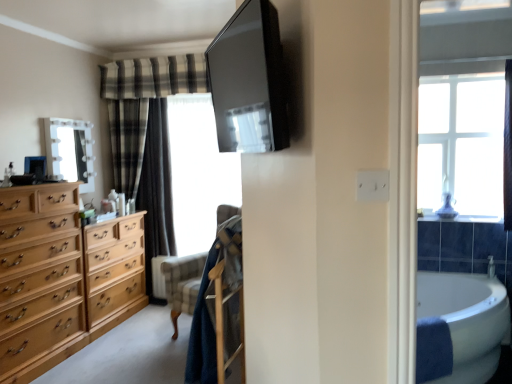
Question: Is white glossy mirror at upper left oriented towards velvet-like beige armchair at center?

Choices:
 (A) no
 (B) yes

Answer: (A)

Question: Is white glossy mirror at upper left positioned in front of velvet-like beige armchair at center?

Choices:
 (A) yes
 (B) no

Answer: (B)

Question: Is white glossy mirror at upper left with velvet-like beige armchair at center?

Choices:
 (A) no
 (B) yes

Answer: (A)

Question: Is white glossy mirror at upper left shorter than velvet-like beige armchair at center?

Choices:
 (A) yes
 (B) no

Answer: (A)

Question: Is white glossy mirror at upper left facing away from velvet-like beige armchair at center?

Choices:
 (A) yes
 (B) no

Answer: (B)

Question: Is light brown wood dresser at left situated inside light brown wood chest of drawers at left or outside?

Choices:
 (A) inside
 (B) outside

Answer: (B)

Question: Is point (130, 264) closer or farther from the camera than point (40, 319)?

Choices:
 (A) farther
 (B) closer

Answer: (A)

Question: From a real-world perspective, is light brown wood dresser at left physically located above or below light brown wood chest of drawers at left?

Choices:
 (A) above
 (B) below

Answer: (B)

Question: Considering their positions, is light brown wood dresser at left located in front of or behind light brown wood chest of drawers at left?

Choices:
 (A) behind
 (B) front

Answer: (A)

Question: From a real-world perspective, is transparent plastic window screen at center above or below plaid fabric curtain at left?

Choices:
 (A) above
 (B) below

Answer: (A)

Question: Is transparent plastic window screen at center taller or shorter than plaid fabric curtain at left?

Choices:
 (A) tall
 (B) short

Answer: (B)

Question: Is transparent plastic window screen at center in front of or behind plaid fabric curtain at left in the image?

Choices:
 (A) front
 (B) behind

Answer: (A)

Question: Considering the positions of transparent plastic window screen at center and plaid fabric curtain at left in the image, is transparent plastic window screen at center bigger or smaller than plaid fabric curtain at left?

Choices:
 (A) small
 (B) big

Answer: (A)

Question: From a real-world perspective, is white glossy bathtub at lower right physically located above or below light brown wood dresser at left?

Choices:
 (A) below
 (B) above

Answer: (A)

Question: Considering the positions of white glossy bathtub at lower right and light brown wood dresser at left in the image, is white glossy bathtub at lower right taller or shorter than light brown wood dresser at left?

Choices:
 (A) short
 (B) tall

Answer: (A)